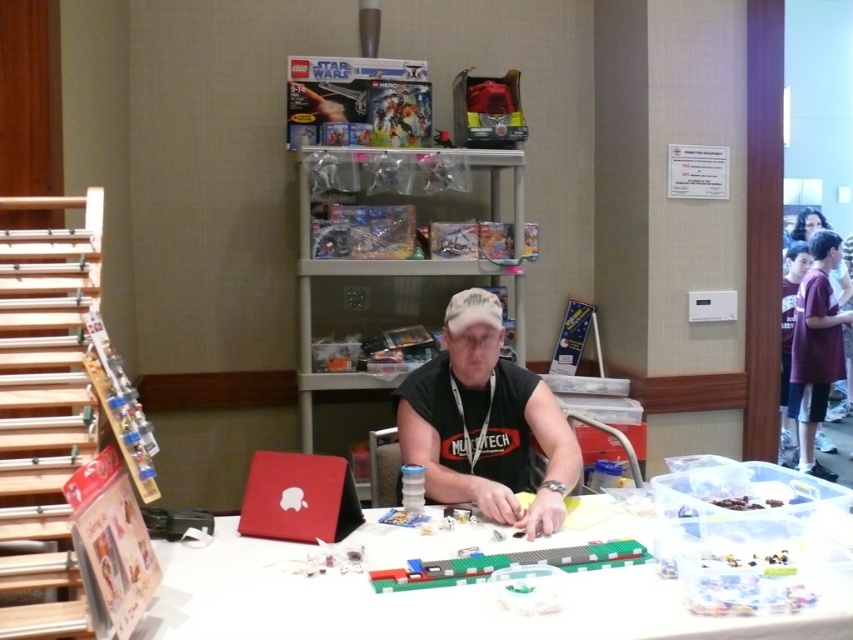
What are the coordinates of the white plastic table at center?

The white plastic table at center is located at point [428,602].

You are organizing a LEGO workshop and need to place a large LEGO set on the table. Given that the white plastic table at center is bigger than the matte red laptop at center, will the table have enough space for the LEGO set if the set is the same size as the laptop?

Yes, the white plastic table at center has enough space for the LEGO set since it is bigger than the matte red laptop at center.

You are at a LEGO convention and see a white plastic table at center and a matte red laptop at center. Which object is positioned to the right of the other?

The white plastic table at center is to the right of the matte red laptop at center.